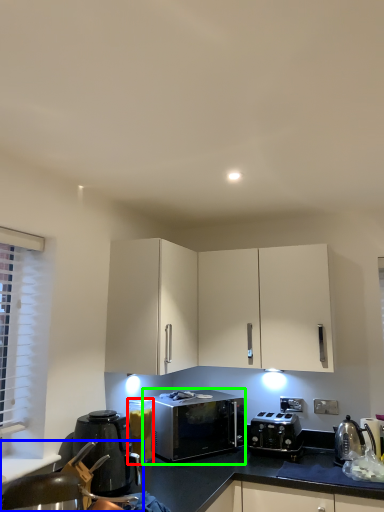
Question: Based on their relative distances, which object is farther from appliance (highlighted by a red box)? Choose from swivel chair (highlighted by a blue box) and microwave oven (highlighted by a green box).

Choices:
 (A) swivel chair
 (B) microwave oven

Answer: (A)